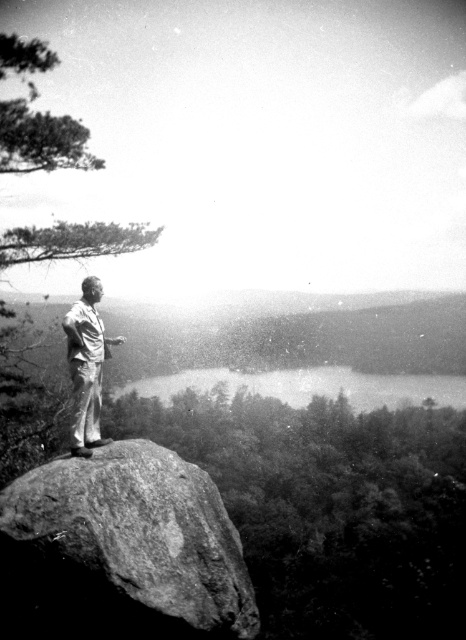
Looking at this image, you are a photographer planning to capture a landscape shot that includes both the smooth water at center and the light beige cotton pants at center. Given their distance apart, can you estimate how far apart they are in the scene?

The smooth water at center is 167.33 meters away from the light beige cotton pants at center, so they are approximately 167.33 meters apart in the scene.

You are standing at the point marked by the coordinates point (122,550) in the image. What is the type of rock formation you are standing on?

The point (122,550) marks smooth granite boulder at center.

You are a photographer planning to capture the same scene as the image provided. You want to place a tripod at the exact location of the point marked at coordinates point (122,550). Based on the description of the terrain at that point, will the tripod remain stable?

The point (122,550) corresponds to a smooth granite boulder at center, which has a stable surface. Therefore, the tripod will remain stable.